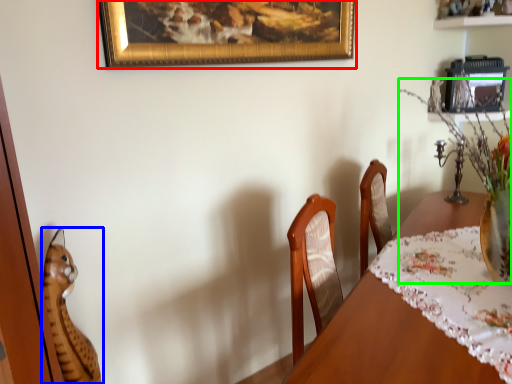
Question: Which object is positioned closest to picture frame (highlighted by a red box)? Select from cat (highlighted by a blue box) and floral arrangement (highlighted by a green box).

Choices:
 (A) cat
 (B) floral arrangement

Answer: (B)